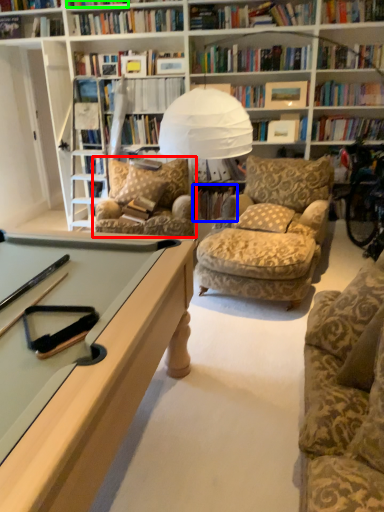
Question: Considering the real-world distances, which object is farthest from chair (highlighted by a red box)? book (highlighted by a blue box) or book (highlighted by a green box)?

Choices:
 (A) book
 (B) book

Answer: (B)